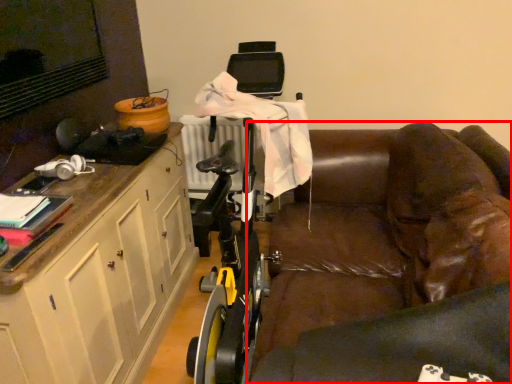
Question: From the image's perspective, where is studio couch (annotated by the red box) located relative to cabinetry?

Choices:
 (A) above
 (B) below

Answer: (A)